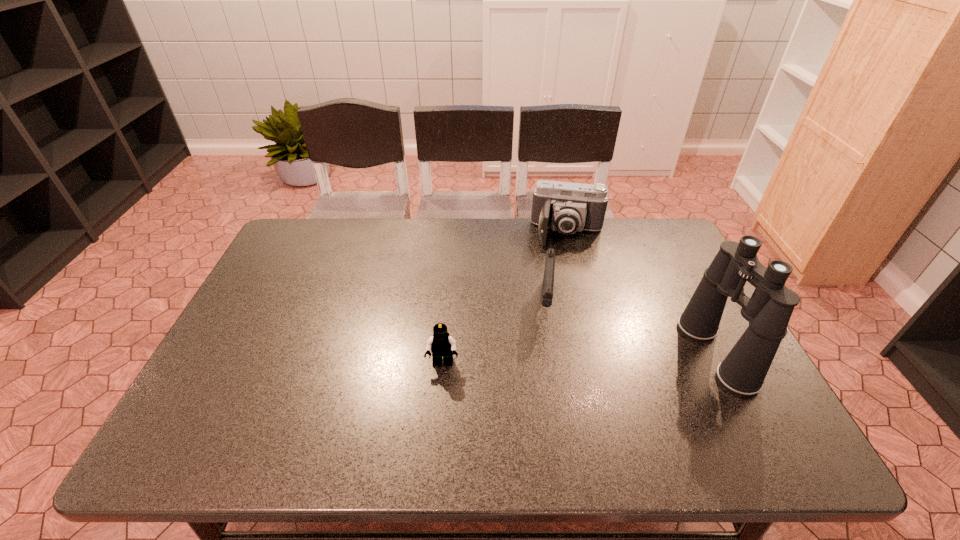
Locate an element on the screen. vacant spot on the desktop that is between the Lego and the tallest object and is positioned at the front of the farthest object with an open lens cover is located at coordinates pos(558,359).

Find the location of `free space on the desktop that is between the leftmost object and the binoculars and is positioned at the barrel of the pistol`. free space on the desktop that is between the leftmost object and the binoculars and is positioned at the barrel of the pistol is located at coordinates (541, 360).